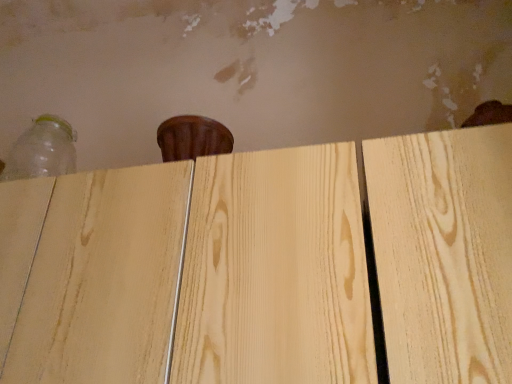
Question: Considering the relative positions of natural wood plywood at center and transparent plastic bottle at upper left in the image provided, is natural wood plywood at center to the left or to the right of transparent plastic bottle at upper left?

Choices:
 (A) right
 (B) left

Answer: (A)

Question: Which is correct: natural wood plywood at center is inside transparent plastic bottle at upper left, or outside of it?

Choices:
 (A) inside
 (B) outside

Answer: (B)

Question: In terms of size, does natural wood plywood at center appear bigger or smaller than transparent plastic bottle at upper left?

Choices:
 (A) big
 (B) small

Answer: (A)

Question: Is transparent plastic bottle at upper left taller or shorter than natural wood plywood at center?

Choices:
 (A) tall
 (B) short

Answer: (B)

Question: Relative to natural wood plywood at center, is transparent plastic bottle at upper left in front or behind?

Choices:
 (A) behind
 (B) front

Answer: (A)

Question: Is transparent plastic bottle at upper left bigger or smaller than natural wood plywood at center?

Choices:
 (A) small
 (B) big

Answer: (A)

Question: Choose the correct answer: Is transparent plastic bottle at upper left inside natural wood plywood at center or outside it?

Choices:
 (A) inside
 (B) outside

Answer: (B)